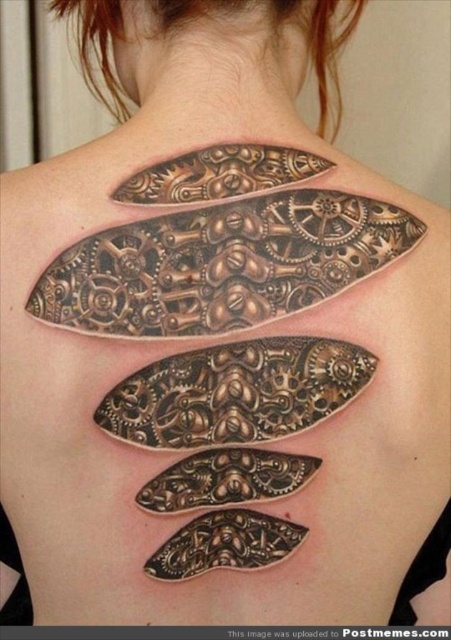
Does bronze metallic gear at upper center have a larger size compared to black textured gear at center?

Yes, bronze metallic gear at upper center is bigger than black textured gear at center.

Based on the photo, does bronze metallic gear at upper center appear on the right side of black textured gear at center?

Incorrect, bronze metallic gear at upper center is not on the right side of black textured gear at center.

What do you see at coordinates (220, 173) in the screenshot?
I see `bronze metallic gear at upper center` at bounding box center [220, 173].

Locate an element on the screen. bronze metallic gear at upper center is located at coordinates (220, 173).

Does point (139, 312) come farther from viewer compared to point (161, 490)?

No.

Between brushed metal gear at upper center and black textured gear at center, which one has less height?

Standing shorter between the two is black textured gear at center.

Is point (192, 221) farther from viewer compared to point (230, 474)?

No.

Locate an element on the screen. The height and width of the screenshot is (640, 451). brushed metal gear at upper center is located at coordinates (220, 264).

Does bronze metallic gear at center come in front of bronze metallic gear at upper center?

Yes, bronze metallic gear at center is closer to the viewer.

Who is shorter, bronze metallic gear at center or bronze metallic gear at upper center?

Standing shorter between the two is bronze metallic gear at upper center.

Is point (328, 358) more distant than point (133, 179)?

No, it is not.

Image resolution: width=451 pixels, height=640 pixels. I want to click on bronze metallic gear at center, so click(x=235, y=392).